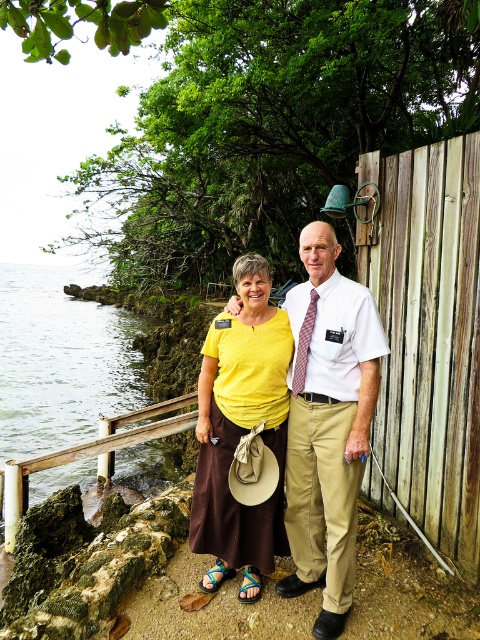
You are a photographer trying to capture a landscape shot of the clear water at lower left and the yellow matte shirt at center. Which object should you focus on first if you want to include both in your frame without zooming?

The clear water at lower left is bigger than the yellow matte shirt at center, so you should focus on the clear water at lower left first to ensure it fits properly in the frame before adjusting for the smaller yellow matte shirt at center.

You are a photographer trying to capture a clear image of the yellow cotton shirt at center and the yellow matte shirt at center. Which shirt is covering part of the other shirt in the photo?

The yellow cotton shirt at center is positioned over the yellow matte shirt at center, so it is covering part of the yellow matte shirt at center.